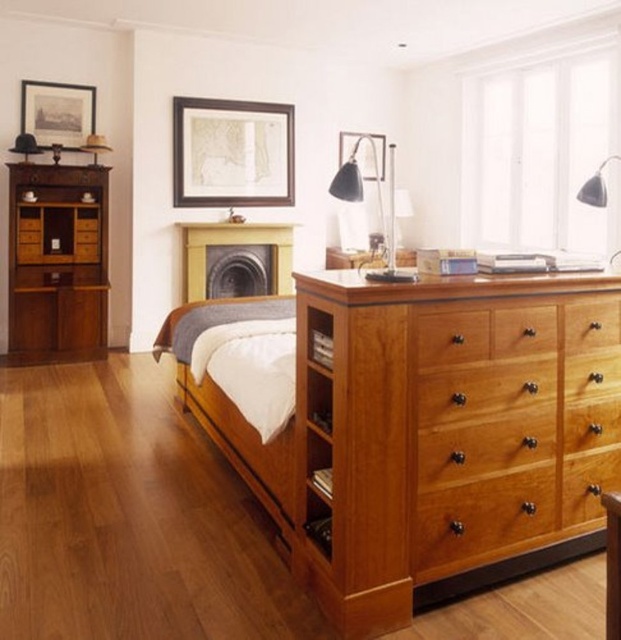
You are moving into a new apartment and need to place the cherry wood dresser at lower right and the light brown wooden bed at center into a small bedroom. Which of the two items takes up more space?

The light brown wooden bed at center takes up more space than the cherry wood dresser at lower right because the cherry wood dresser at lower right has a smaller size compared to light brown wooden bed at center.

You are a painter standing in the center of the room. You want to paint both the matte wooden picture frame at upper center and the matte black picture frame at upper center. Since you can only paint one at a time, which one should you paint first to minimize the distance you have to walk between them?

You should paint the matte wooden picture frame at upper center first because it is closer to you than the matte black picture frame at upper center, so you can minimize the distance you have to walk between them.